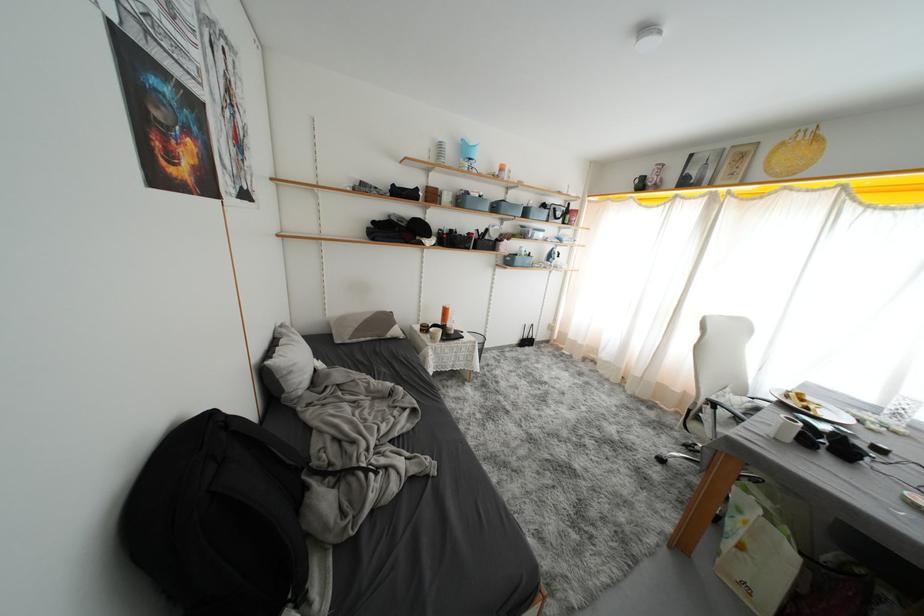
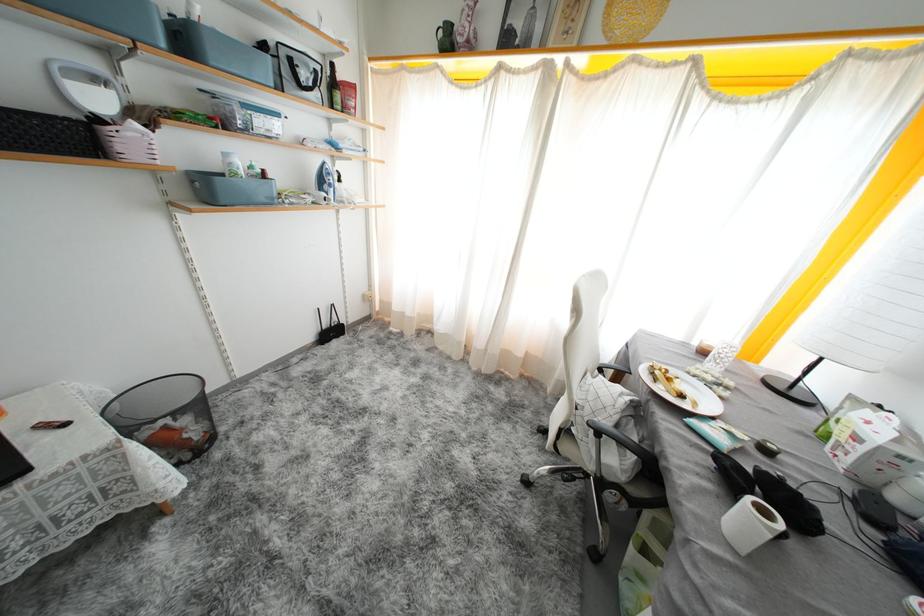
In the second image, find the point that corresponds to (x=516, y=265) in the first image.

(215, 196)